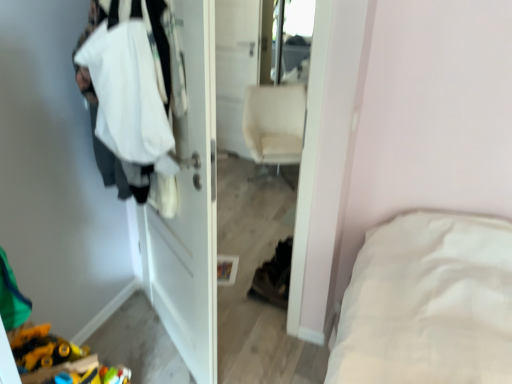
Question: From a real-world perspective, is white matte door at center beneath beige fabric chair at center?

Choices:
 (A) no
 (B) yes

Answer: (A)

Question: Would you say white matte door at center contains beige fabric chair at center?

Choices:
 (A) yes
 (B) no

Answer: (B)

Question: Is white matte door at center further to camera compared to beige fabric chair at center?

Choices:
 (A) no
 (B) yes

Answer: (A)

Question: Are white matte door at center and beige fabric chair at center making contact?

Choices:
 (A) no
 (B) yes

Answer: (A)

Question: Considering the relative sizes of white matte door at center and beige fabric chair at center in the image provided, is white matte door at center bigger than beige fabric chair at center?

Choices:
 (A) yes
 (B) no

Answer: (B)

Question: Is white matte door at center oriented away from beige fabric chair at center?

Choices:
 (A) no
 (B) yes

Answer: (A)

Question: Can you confirm if white matte door at center is taller than glossy plastic mirror at upper center?

Choices:
 (A) yes
 (B) no

Answer: (A)

Question: Does white matte door at center have a lesser height compared to glossy plastic mirror at upper center?

Choices:
 (A) no
 (B) yes

Answer: (A)

Question: Could you tell me if white matte door at center is turned towards glossy plastic mirror at upper center?

Choices:
 (A) yes
 (B) no

Answer: (B)

Question: Can you confirm if white matte door at center is positioned to the right of glossy plastic mirror at upper center?

Choices:
 (A) yes
 (B) no

Answer: (B)

Question: From a real-world perspective, does white matte door at center sit lower than glossy plastic mirror at upper center?

Choices:
 (A) yes
 (B) no

Answer: (A)

Question: Is white matte door at center positioned beyond the bounds of glossy plastic mirror at upper center?

Choices:
 (A) yes
 (B) no

Answer: (A)

Question: Considering the relative positions of beige fabric chair at center and glossy plastic mirror at upper center in the image provided, is beige fabric chair at center behind glossy plastic mirror at upper center?

Choices:
 (A) yes
 (B) no

Answer: (B)